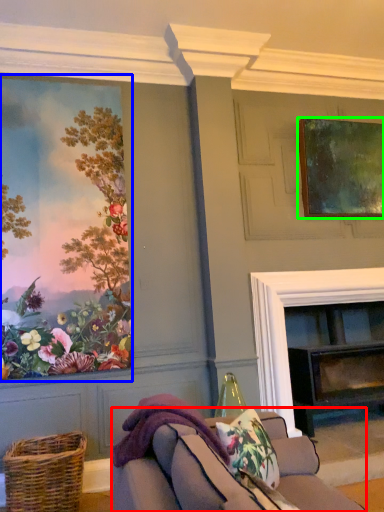
Question: Considering the real-world distances, which object is farthest from studio couch (highlighted by a red box)? picture frame (highlighted by a blue box) or picture frame (highlighted by a green box)?

Choices:
 (A) picture frame
 (B) picture frame

Answer: (B)